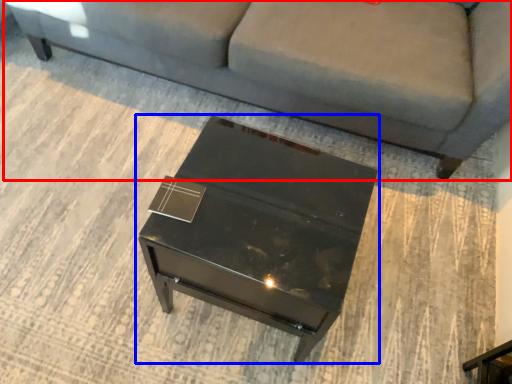
Question: Which object is closer to the camera taking this photo, studio couch (highlighted by a red box) or table (highlighted by a blue box)?

Choices:
 (A) studio couch
 (B) table

Answer: (B)